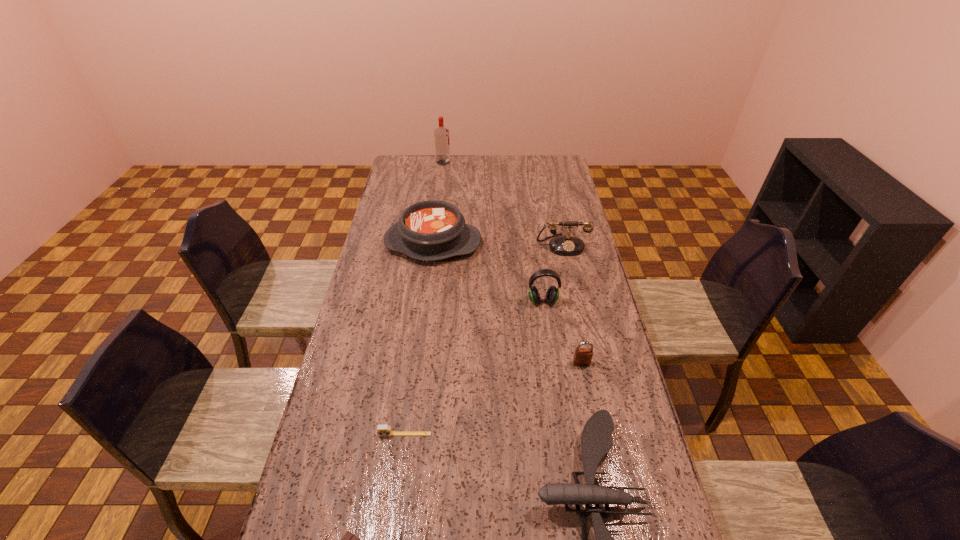
Locate an element on the screen. vodka is located at coordinates (441, 134).

Find the location of a particular element. the tallest object is located at coordinates (441, 134).

At what (x,y) coordinates should I click in order to perform the action: click on headset. Please return your answer as a coordinate pair (x, y). The image size is (960, 540). Looking at the image, I should click on (552, 295).

Find the location of a particular element. This screenshot has height=540, width=960. casserole is located at coordinates (431, 230).

The width and height of the screenshot is (960, 540). In order to click on telephone in this screenshot , I will do `click(562, 245)`.

You are a GUI agent. You are given a task and a screenshot of the screen. Output one action in this format:
    pyautogui.click(x=<x>, y=<y>)
    Task: Click on the padlock
    Image resolution: width=960 pixels, height=540 pixels.
    Given the screenshot: What is the action you would take?
    pyautogui.click(x=582, y=356)

Where is `tape measure`? The image size is (960, 540). tape measure is located at coordinates (382, 430).

The image size is (960, 540). Identify the location of free space located on the front label of the vodka. (511, 163).

I want to click on free region located 0.140m on the ear cups of the headset, so click(x=548, y=340).

In order to click on free space located on the right of the casserole in this screenshot , I will do `click(503, 243)`.